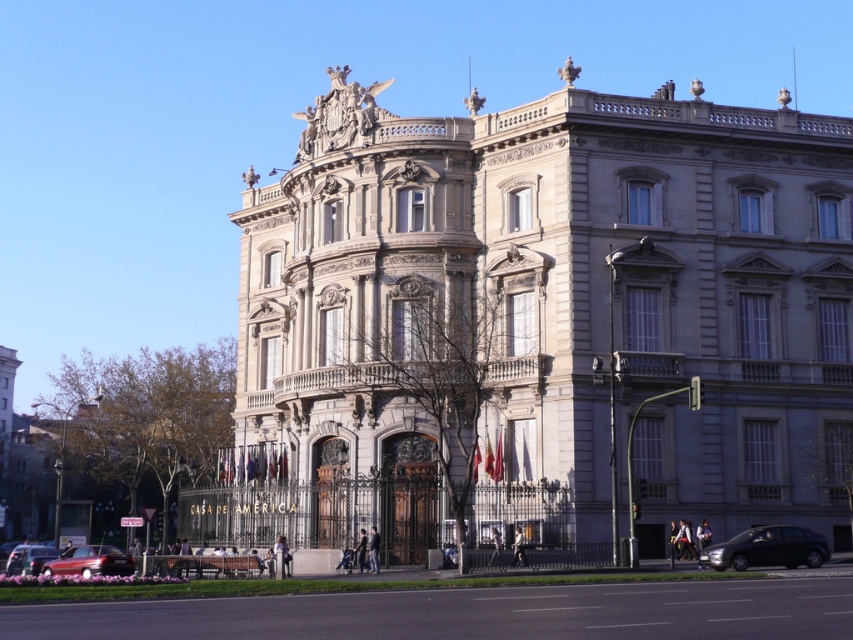
You are standing in front of a grand building and want to take a photo of the gray stone palace at center. If your camera has a maximum focus range of 150 feet, will you need to move closer to capture it clearly?

The gray stone palace at center is 153.32 feet from viewer. Since the distance exceeds the camera maximum focus range of 150 feet, you need to move closer to ensure the camera can focus properly.

You are standing in front of the Casa de America building and want to take a photo. You notice two points marked on the ground at coordinates point (x=549, y=445) and point (x=20, y=547). Which point should you stand on to have the building appear larger in your photo?

You should stand on point (x=549, y=445) because it is closer to the viewer, making the building appear larger in the photo compared to point (x=20, y=547).

You are standing in front of the building labeled Casa de America. There is a point at coordinates (541, 324). What is located at that point?

The gray stone palace at center is located at point (541, 324).